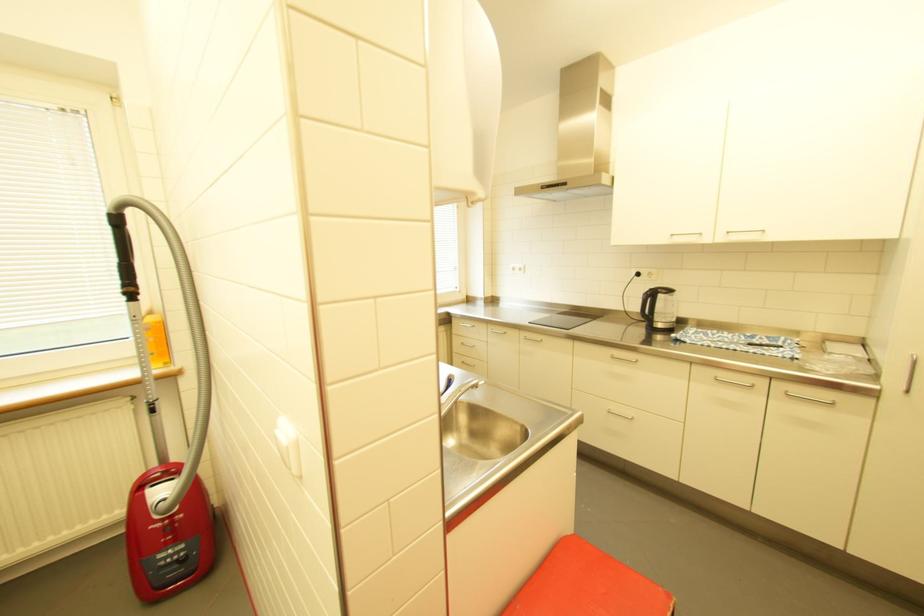
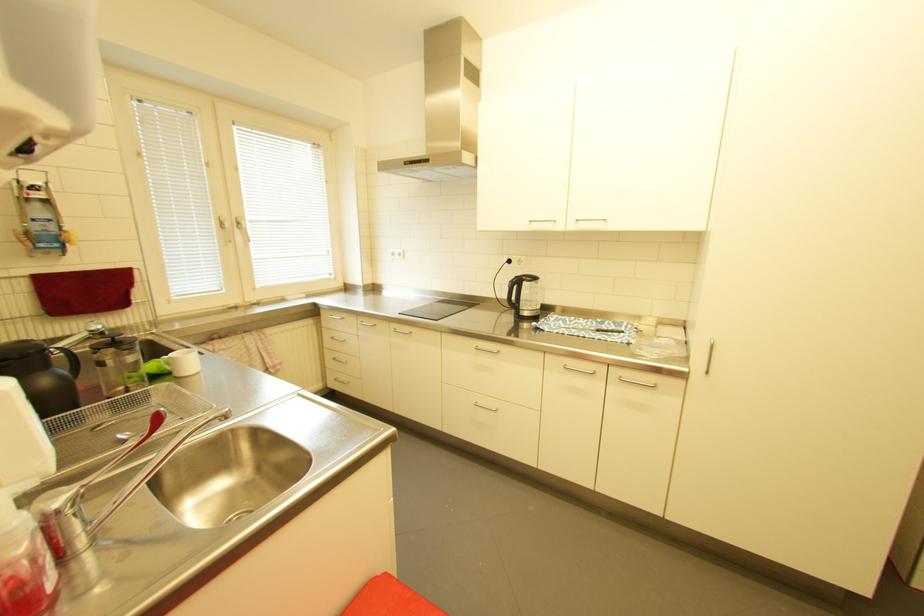
Which direction would the cameraman need to move to produce the second image?

The cameraman walked toward right, forward.